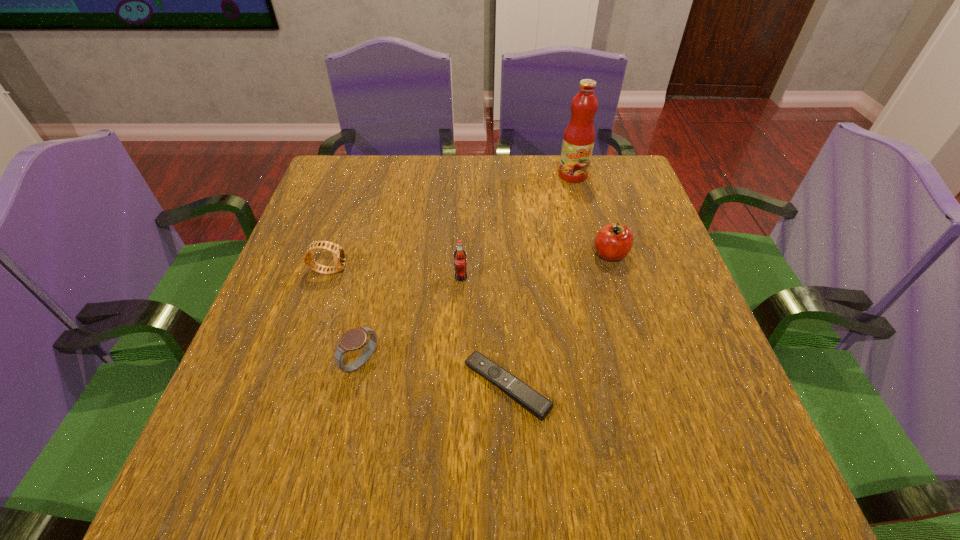
Find the location of a particular element. This screenshot has height=540, width=960. vacant space that satisfies the following two spatial constraints: 1. on the face of the shortest object; 2. on the left side of the farther watch is located at coordinates (290, 386).

Identify the location of blank area in the image that satisfies the following two spatial constraints: 1. on the front side of the apple; 2. on the face of the leftmost object. (615, 270).

Where is `free space that satisfies the following two spatial constraints: 1. on the face of the farther watch; 2. on the back side of the second object from left to right`? This screenshot has width=960, height=540. free space that satisfies the following two spatial constraints: 1. on the face of the farther watch; 2. on the back side of the second object from left to right is located at coordinates (298, 363).